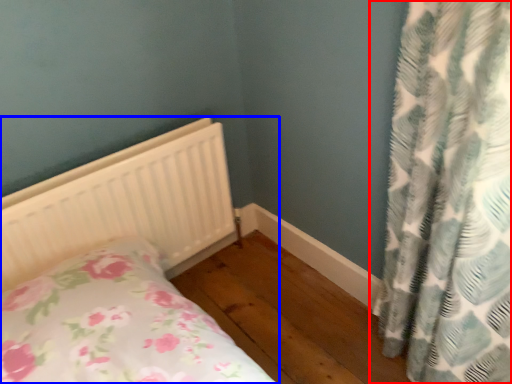
Question: Which point is further to the camera, curtain (highlighted by a red box) or bed (highlighted by a blue box)?

Choices:
 (A) curtain
 (B) bed

Answer: (B)